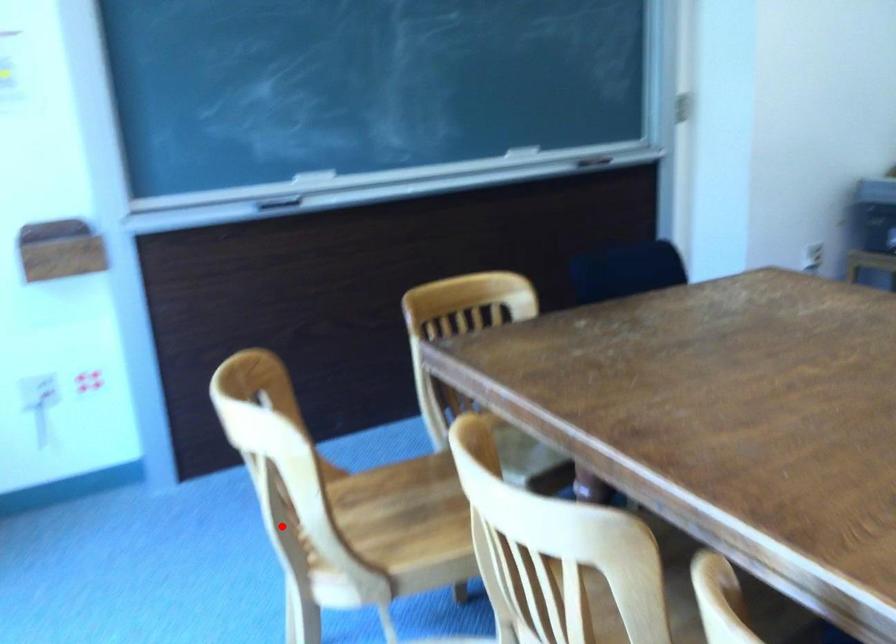
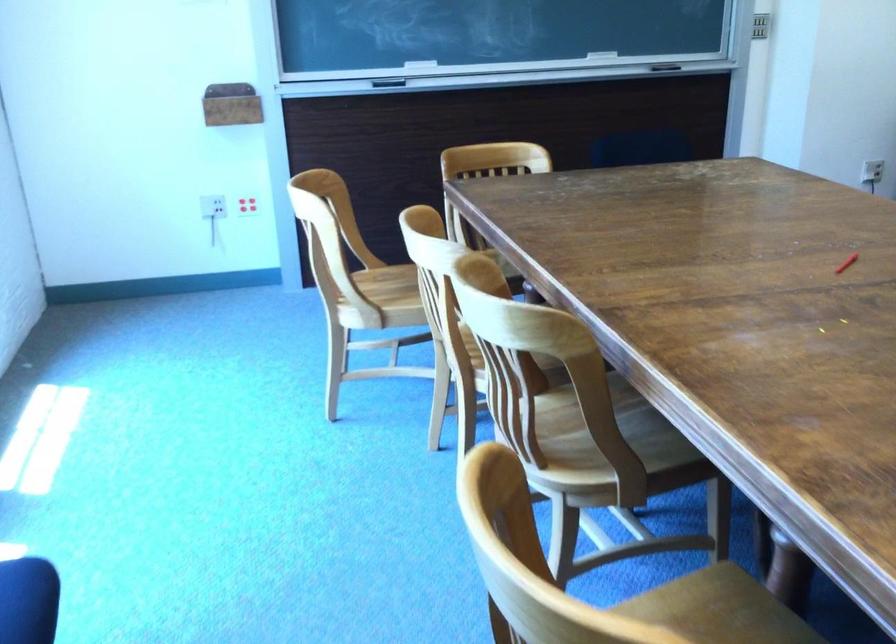
Find the pixel in the second image that matches the highlighted location in the first image.

(328, 276)